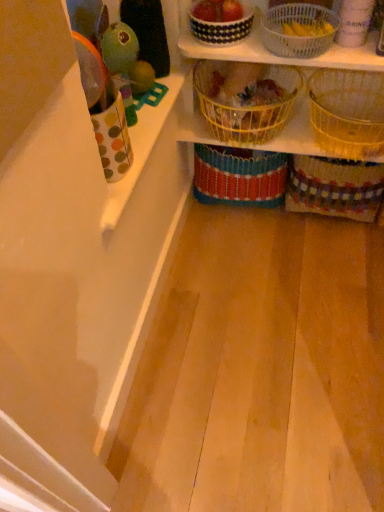
In order to face black and white checkered basket at upper center, which ranks as the 6th basket in right-to-left order, should I rotate leftwards or rightwards?

You should look right and rotate roughly 4.111 degrees.

In order to face polka dot fabric cup at left, should I rotate leftwards or rightwards?

A 8.949 degree turn to the left will do.

What is the approximate height of polka dot fabric cup at left?

13.52 inches.

In the scene shown: What is the approximate height of multicolored woven basket at lower right, the 6th basket in the left-to-right sequence?

It is 32.62 centimeters.

Describe the element at coordinates (239, 176) in the screenshot. I see `yellow woven basket at center, which ranks as the fourth basket in right-to-left order` at that location.

Where is `woven yellow basket at upper right, the 2th basket when ordered from right to left`? Image resolution: width=384 pixels, height=512 pixels. woven yellow basket at upper right, the 2th basket when ordered from right to left is located at coordinates (348, 112).

Does white woven basket at upper center, the 3th basket when ordered from right to left, appear on the left side of multicolored woven basket at lower right, which appears as the 1th basket when viewed from the right?

Indeed, white woven basket at upper center, the 3th basket when ordered from right to left, is positioned on the left side of multicolored woven basket at lower right, which appears as the 1th basket when viewed from the right.

From the image's perspective, which object appears higher, white woven basket at upper center, the fourth basket positioned from the left, or multicolored woven basket at lower right, the 6th basket in the left-to-right sequence?

white woven basket at upper center, the fourth basket positioned from the left, from the image's perspective.

Is white woven basket at upper center, the 3th basket when ordered from right to left, inside the boundaries of multicolored woven basket at lower right, the 6th basket in the left-to-right sequence, or outside?

white woven basket at upper center, the 3th basket when ordered from right to left, is outside multicolored woven basket at lower right, the 6th basket in the left-to-right sequence.

Who is bigger, woven yellow basket at upper right, which is counted as the fifth basket, starting from the left, or yellow wire basket at center, the 2th basket from the left?

With larger size is yellow wire basket at center, the 2th basket from the left.

Between woven yellow basket at upper right, which is counted as the fifth basket, starting from the left, and yellow wire basket at center, the 2th basket from the left, which one has more height?

woven yellow basket at upper right, which is counted as the fifth basket, starting from the left, is taller.

Is woven yellow basket at upper right, which is counted as the fifth basket, starting from the left, wider or thinner than yellow wire basket at center, the fifth basket in the right-to-left sequence?

Clearly, woven yellow basket at upper right, which is counted as the fifth basket, starting from the left, has more width compared to yellow wire basket at center, the fifth basket in the right-to-left sequence.

Based on the photo, is woven yellow basket at upper right, which is counted as the fifth basket, starting from the left, positioned with its back to yellow wire basket at center, the fifth basket in the right-to-left sequence?

woven yellow basket at upper right, which is counted as the fifth basket, starting from the left, does not have its back to yellow wire basket at center, the fifth basket in the right-to-left sequence.

From a real-world perspective, count 2nd baskets downward from the polka dot fabric cup at left and point to it. Please provide its 2D coordinates.

[(294, 35)]

Could you tell me if polka dot fabric cup at left is facing white woven basket at upper center, the 3th basket when ordered from right to left?

No, polka dot fabric cup at left is not oriented towards white woven basket at upper center, the 3th basket when ordered from right to left.

Based on the photo, how far apart are polka dot fabric cup at left and white woven basket at upper center, the 3th basket when ordered from right to left?

They are 19.74 inches apart.

Is polka dot fabric cup at left spatially inside white woven basket at upper center, the fourth basket positioned from the left, or outside of it?

polka dot fabric cup at left cannot be found inside white woven basket at upper center, the fourth basket positioned from the left.

Considering the points (290, 200) and (271, 8), which point is behind, point (290, 200) or point (271, 8)?

The point (290, 200) is farther from the camera.

Is multicolored woven basket at lower right, which appears as the 1th basket when viewed from the right, not within white woven basket at upper center, the fourth basket positioned from the left?

Yes, multicolored woven basket at lower right, which appears as the 1th basket when viewed from the right, is located beyond the bounds of white woven basket at upper center, the fourth basket positioned from the left.

Considering the positions of objects multicolored woven basket at lower right, which appears as the 1th basket when viewed from the right, and white woven basket at upper center, the 3th basket when ordered from right to left, in the image provided, who is more to the left, multicolored woven basket at lower right, which appears as the 1th basket when viewed from the right, or white woven basket at upper center, the 3th basket when ordered from right to left,?

white woven basket at upper center, the 3th basket when ordered from right to left.

From the picture: From a real-world perspective, who is located higher, multicolored woven basket at lower right, the 6th basket in the left-to-right sequence, or white woven basket at upper center, the fourth basket positioned from the left?

In real-world perspective, white woven basket at upper center, the fourth basket positioned from the left, is above.

Is multicolored woven basket at lower right, the 6th basket in the left-to-right sequence, oriented away from yellow woven basket at center, the 3th basket when ordered from left to right?

multicolored woven basket at lower right, the 6th basket in the left-to-right sequence, is not turned away from yellow woven basket at center, the 3th basket when ordered from left to right.

Are multicolored woven basket at lower right, the 6th basket in the left-to-right sequence, and yellow woven basket at center, which ranks as the fourth basket in right-to-left order, far apart?

Actually, multicolored woven basket at lower right, the 6th basket in the left-to-right sequence, and yellow woven basket at center, which ranks as the fourth basket in right-to-left order, are a little close together.

Does multicolored woven basket at lower right, the 6th basket in the left-to-right sequence, contain yellow woven basket at center, the 3th basket when ordered from left to right?

No, yellow woven basket at center, the 3th basket when ordered from left to right, is located outside of multicolored woven basket at lower right, the 6th basket in the left-to-right sequence.

From the image's perspective, would you say multicolored woven basket at lower right, the 6th basket in the left-to-right sequence, is shown under yellow woven basket at center, which ranks as the fourth basket in right-to-left order?

Correct, multicolored woven basket at lower right, the 6th basket in the left-to-right sequence, appears lower than yellow woven basket at center, which ranks as the fourth basket in right-to-left order, in the image.

From the image's perspective, is multicolored woven basket at lower right, the 6th basket in the left-to-right sequence, over black and white checkered basket at upper center, which ranks as the 6th basket in right-to-left order?

No, from the image's perspective, multicolored woven basket at lower right, the 6th basket in the left-to-right sequence, is not on top of black and white checkered basket at upper center, which ranks as the 6th basket in right-to-left order.

Which object is closer to the camera, multicolored woven basket at lower right, which appears as the 1th basket when viewed from the right, or black and white checkered basket at upper center, which ranks as the 6th basket in right-to-left order?

black and white checkered basket at upper center, which ranks as the 6th basket in right-to-left order, is in front.

From a real-world perspective, is multicolored woven basket at lower right, the 6th basket in the left-to-right sequence, positioned under black and white checkered basket at upper center, the 1th basket viewed from the left, based on gravity?

Yes.

Is multicolored woven basket at lower right, the 6th basket in the left-to-right sequence, spatially inside black and white checkered basket at upper center, the 1th basket viewed from the left, or outside of it?

multicolored woven basket at lower right, the 6th basket in the left-to-right sequence, cannot be found inside black and white checkered basket at upper center, the 1th basket viewed from the left.

From the image's perspective, is woven yellow basket at upper right, which is counted as the fifth basket, starting from the left, above polka dot fabric cup at left?

Correct, woven yellow basket at upper right, which is counted as the fifth basket, starting from the left, appears higher than polka dot fabric cup at left in the image.

Could polka dot fabric cup at left be considered to be inside woven yellow basket at upper right, the 2th basket when ordered from right to left?

No, polka dot fabric cup at left is not a part of woven yellow basket at upper right, the 2th basket when ordered from right to left.

Considering the sizes of objects woven yellow basket at upper right, which is counted as the fifth basket, starting from the left, and polka dot fabric cup at left in the image provided, who is taller, woven yellow basket at upper right, which is counted as the fifth basket, starting from the left, or polka dot fabric cup at left?

With more height is polka dot fabric cup at left.

From the multicolored woven basket at lower right, which appears as the 1th basket when viewed from the right, count 4th baskets forward and point to it. Please provide its 2D coordinates.

[(294, 35)]

Identify the location of the 1st basket above when counting from the woven yellow basket at upper right, the 2th basket when ordered from right to left (from the image's perspective). (245, 106).

Looking at the image, which one is located further to black and white checkered basket at upper center, the 1th basket viewed from the left, woven yellow basket at upper right, which is counted as the fifth basket, starting from the left, or yellow woven basket at center, which ranks as the fourth basket in right-to-left order?

The object further to black and white checkered basket at upper center, the 1th basket viewed from the left, is yellow woven basket at center, which ranks as the fourth basket in right-to-left order.

Estimate the real-world distances between objects in this image. Which object is closer to woven yellow basket at upper right, the 2th basket when ordered from right to left, polka dot fabric cup at left or white woven basket at upper center, the 3th basket when ordered from right to left?

white woven basket at upper center, the 3th basket when ordered from right to left, is closer to woven yellow basket at upper right, the 2th basket when ordered from right to left.

From the image, which object appears to be nearer to white woven basket at upper center, the 3th basket when ordered from right to left, yellow wire basket at center, the 2th basket from the left, or polka dot fabric cup at left?

yellow wire basket at center, the 2th basket from the left, is closer to white woven basket at upper center, the 3th basket when ordered from right to left.

Based on their spatial positions, is black and white checkered basket at upper center, the 1th basket viewed from the left, or woven yellow basket at upper right, the 2th basket when ordered from right to left, closer to polka dot fabric cup at left?

The object closer to polka dot fabric cup at left is black and white checkered basket at upper center, the 1th basket viewed from the left.

Estimate the real-world distances between objects in this image. Which object is further from white woven basket at upper center, the fourth basket positioned from the left, woven yellow basket at upper right, which is counted as the fifth basket, starting from the left, or yellow woven basket at center, the 3th basket when ordered from left to right?

Based on the image, yellow woven basket at center, the 3th basket when ordered from left to right, appears to be further to white woven basket at upper center, the fourth basket positioned from the left.

Which object lies nearer to the anchor point multicolored woven basket at lower right, the 6th basket in the left-to-right sequence, white woven basket at upper center, the 3th basket when ordered from right to left, or black and white checkered basket at upper center, the 1th basket viewed from the left?

Based on the image, white woven basket at upper center, the 3th basket when ordered from right to left, appears to be nearer to multicolored woven basket at lower right, the 6th basket in the left-to-right sequence.

Estimate the real-world distances between objects in this image. Which object is further from yellow wire basket at center, the 2th basket from the left, multicolored woven basket at lower right, the 6th basket in the left-to-right sequence, or yellow woven basket at center, which ranks as the fourth basket in right-to-left order?

multicolored woven basket at lower right, the 6th basket in the left-to-right sequence, is further to yellow wire basket at center, the 2th basket from the left.

When comparing their distances from woven yellow basket at upper right, the 2th basket when ordered from right to left, does black and white checkered basket at upper center, which ranks as the 6th basket in right-to-left order, or yellow woven basket at center, the 3th basket when ordered from left to right, seem closer?

Among the two, yellow woven basket at center, the 3th basket when ordered from left to right, is located nearer to woven yellow basket at upper right, the 2th basket when ordered from right to left.